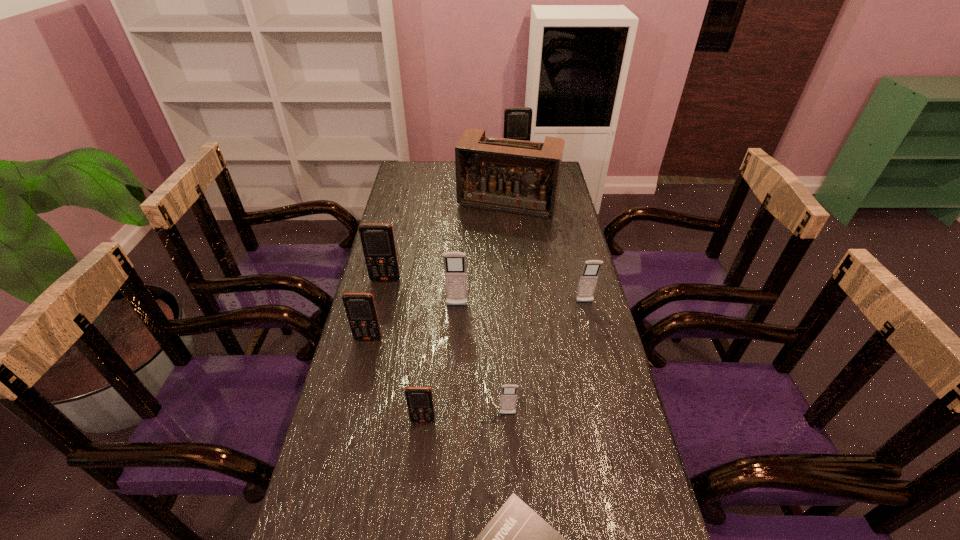
This screenshot has height=540, width=960. I want to click on the tallest cellular telephone, so click(517, 120).

The height and width of the screenshot is (540, 960). Find the location of `the farthest orange cellular telephone`. the farthest orange cellular telephone is located at coordinates (517, 120).

Identify the location of radio receiver. (522, 177).

This screenshot has height=540, width=960. I want to click on the biggest gray cellular telephone, so pos(455,268).

Identify the location of the leftmost gray cellular telephone. The width and height of the screenshot is (960, 540). (455, 268).

At what (x,y) coordinates should I click in order to perform the action: click on the second farthest orange cellular telephone. Please return your answer as a coordinate pair (x, y). Looking at the image, I should click on (x=377, y=239).

Find the location of a particular element. Image resolution: width=960 pixels, height=540 pixels. the second biggest orange cellular telephone is located at coordinates (377, 239).

Find the location of `the rightmost gray cellular telephone`. the rightmost gray cellular telephone is located at coordinates (588, 279).

Locate an element on the screen. This screenshot has width=960, height=540. the second biggest gray cellular telephone is located at coordinates (588, 279).

Identify the location of the second nearest orange cellular telephone. (360, 308).